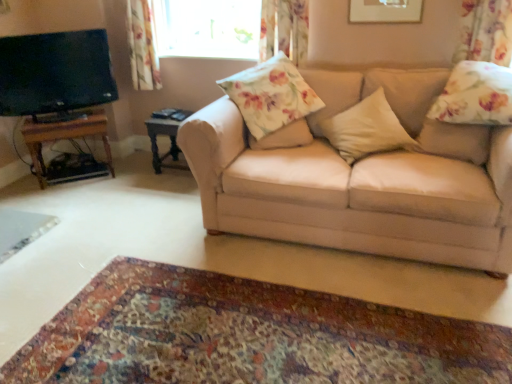
Locate an element on the screen. vacant space to the right of wooden table at left, which appears as the 1th table when viewed from the left is located at coordinates (131, 172).